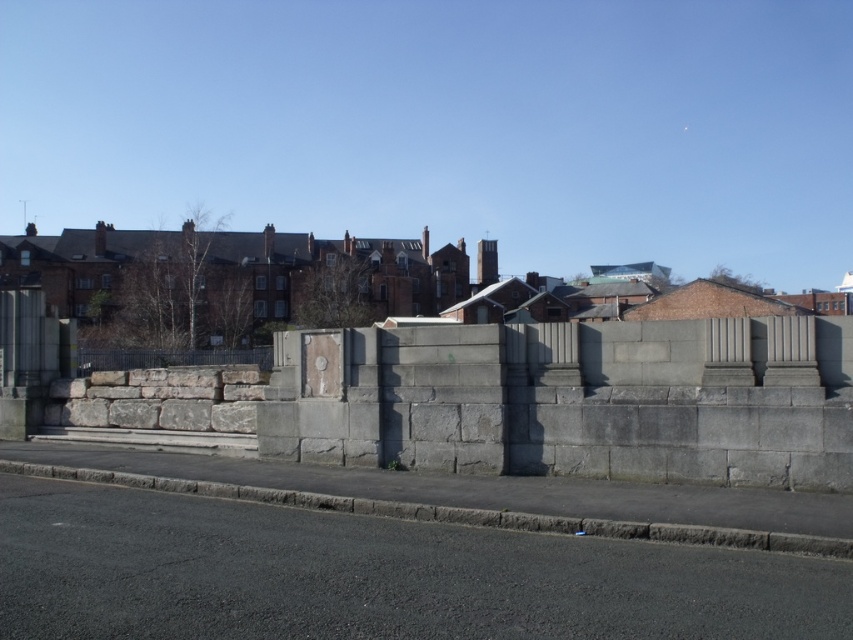
You are a painter who needs to decide which object requires more paint based on their widths. Which one would need more paint between the gray stone wall at center and the black wrought iron fence at left?

The black wrought iron fence at left requires more paint because its width is greater than the gray stone wall at center.